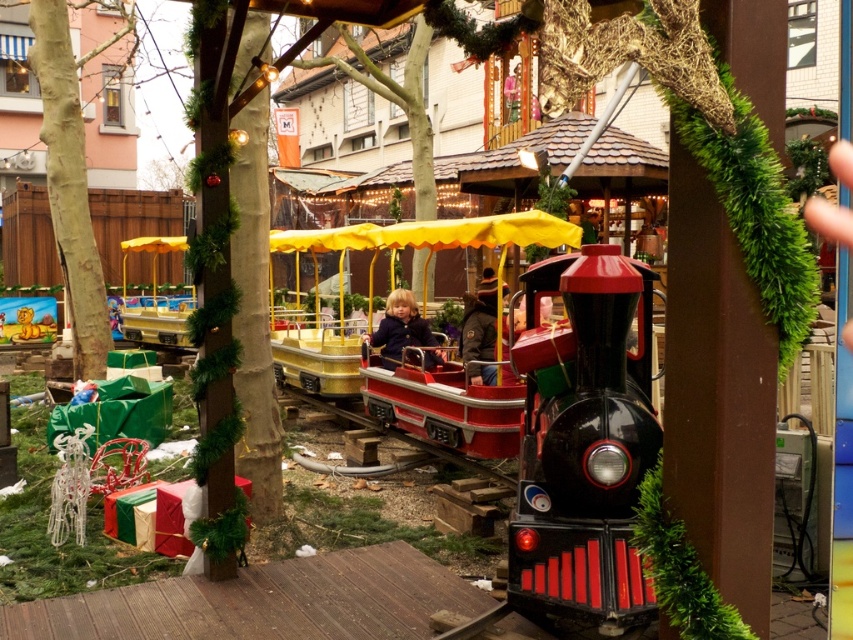
Does dark brown leather jacket at center have a smaller size compared to dark blue jacket at center?

Indeed, dark brown leather jacket at center has a smaller size compared to dark blue jacket at center.

Which is behind, point (479, 312) or point (393, 340)?

The point (393, 340) is more distant.

Identify the location of dark brown leather jacket at center. This screenshot has height=640, width=853. (479, 321).

Who is more distant from viewer, (579, 292) or (96, 244)?

Point (96, 244)

Is shiny red plastic train at center to the right of green rough bark tree at left from the viewer's perspective?

Yes, shiny red plastic train at center is to the right of green rough bark tree at left.

This screenshot has width=853, height=640. What are the coordinates of `shiny red plastic train at center` in the screenshot? It's located at (560, 442).

You are a GUI agent. You are given a task and a screenshot of the screen. Output one action in this format:
    pyautogui.click(x=<x>, y=<y>)
    Task: Click on the shiny red plastic train at center
    This screenshot has width=853, height=640.
    Given the screenshot: What is the action you would take?
    pyautogui.click(x=560, y=442)

Can you confirm if green rough bark tree at left is positioned above dark brown leather jacket at center?

Yes.

Is green rough bark tree at left further to the viewer compared to dark brown leather jacket at center?

Yes, green rough bark tree at left is behind dark brown leather jacket at center.

At what (x,y) coordinates should I click in order to perform the action: click on green rough bark tree at left. Please return your answer as a coordinate pair (x, y). Image resolution: width=853 pixels, height=640 pixels. Looking at the image, I should click on (70, 179).